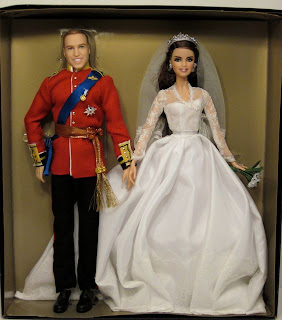
Find the location of a particular element. This screenshot has height=320, width=282. doll 2 is located at coordinates (81, 176).